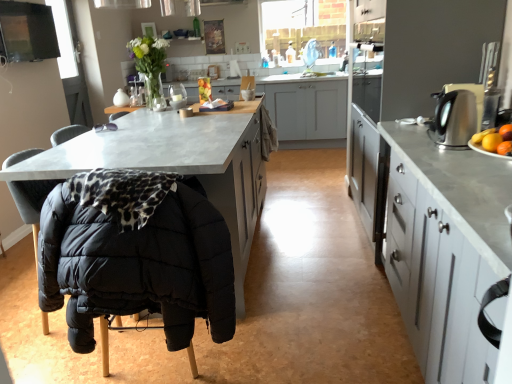
Question: Can you confirm if black quilted fabric folding chair at lower left is wider than satin silver kettle at right?

Choices:
 (A) yes
 (B) no

Answer: (A)

Question: Can you confirm if black quilted fabric folding chair at lower left is positioned to the left of satin silver kettle at right?

Choices:
 (A) no
 (B) yes

Answer: (B)

Question: Can you confirm if black quilted fabric folding chair at lower left is taller than satin silver kettle at right?

Choices:
 (A) yes
 (B) no

Answer: (A)

Question: Considering the relative sizes of black quilted fabric folding chair at lower left and satin silver kettle at right in the image provided, is black quilted fabric folding chair at lower left thinner than satin silver kettle at right?

Choices:
 (A) yes
 (B) no

Answer: (B)

Question: Is black quilted fabric folding chair at lower left oriented towards satin silver kettle at right?

Choices:
 (A) yes
 (B) no

Answer: (B)

Question: Is black quilted fabric folding chair at lower left outside satin silver kettle at right?

Choices:
 (A) yes
 (B) no

Answer: (A)

Question: Is there a large distance between concrete countertop at center, marked as the first cabinetry in a back-to-front arrangement, and matte gray cabinet at center, the second cabinetry in the back-to-front sequence?

Choices:
 (A) yes
 (B) no

Answer: (A)

Question: Is concrete countertop at center, the 3th cabinetry when ordered from front to back, in contact with matte gray cabinet at center, arranged as the second cabinetry when viewed from the front?

Choices:
 (A) no
 (B) yes

Answer: (A)

Question: From the image's perspective, does concrete countertop at center, marked as the first cabinetry in a back-to-front arrangement, appear lower than matte gray cabinet at center, the second cabinetry in the back-to-front sequence?

Choices:
 (A) no
 (B) yes

Answer: (A)

Question: Is concrete countertop at center, the 3th cabinetry when ordered from front to back, taller than matte gray cabinet at center, arranged as the second cabinetry when viewed from the front?

Choices:
 (A) no
 (B) yes

Answer: (A)

Question: Can you confirm if concrete countertop at center, marked as the first cabinetry in a back-to-front arrangement, is bigger than matte gray cabinet at center, arranged as the second cabinetry when viewed from the front?

Choices:
 (A) no
 (B) yes

Answer: (B)

Question: Can you confirm if concrete countertop at center, the 3th cabinetry when ordered from front to back, is shorter than matte gray cabinet at center, the second cabinetry in the back-to-front sequence?

Choices:
 (A) yes
 (B) no

Answer: (A)

Question: Is black quilted fabric folding chair at lower left turned away from metallic gray cabinets at right, which is counted as the 1th cabinetry, starting from the front?

Choices:
 (A) yes
 (B) no

Answer: (B)